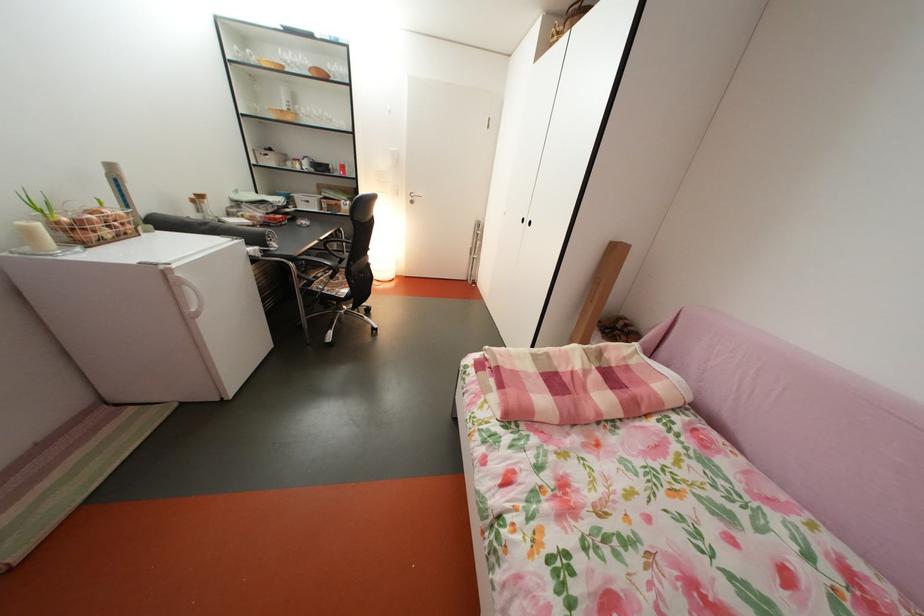
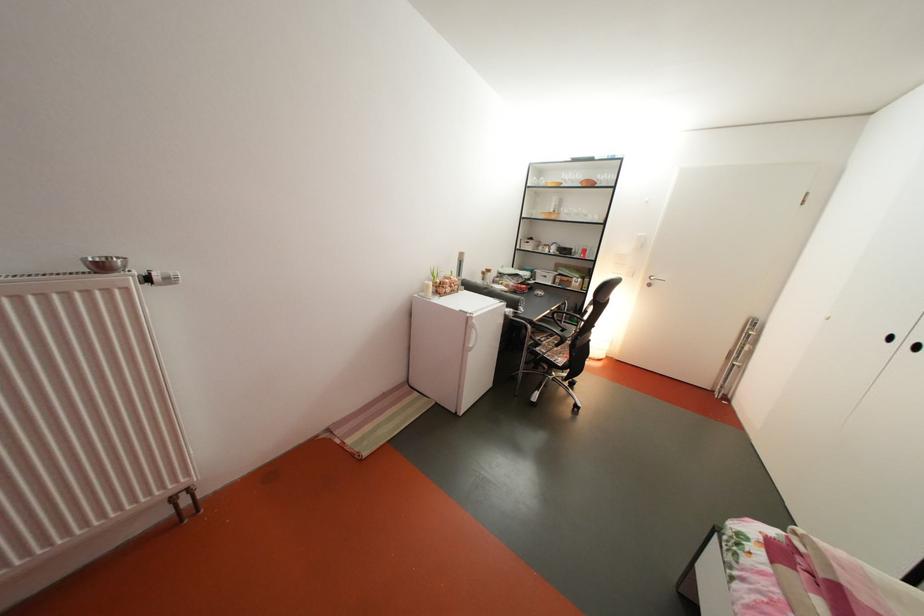
In the second image, find the point that corresponds to [329,75] in the first image.

(600, 187)